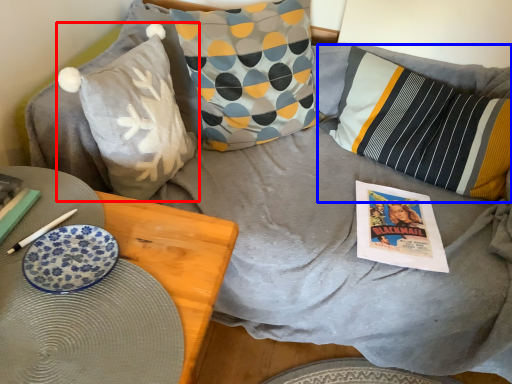
Question: Which of the following is the farthest to the observer, pillow (highlighted by a red box) or pillow (highlighted by a blue box)?

Choices:
 (A) pillow
 (B) pillow

Answer: (B)